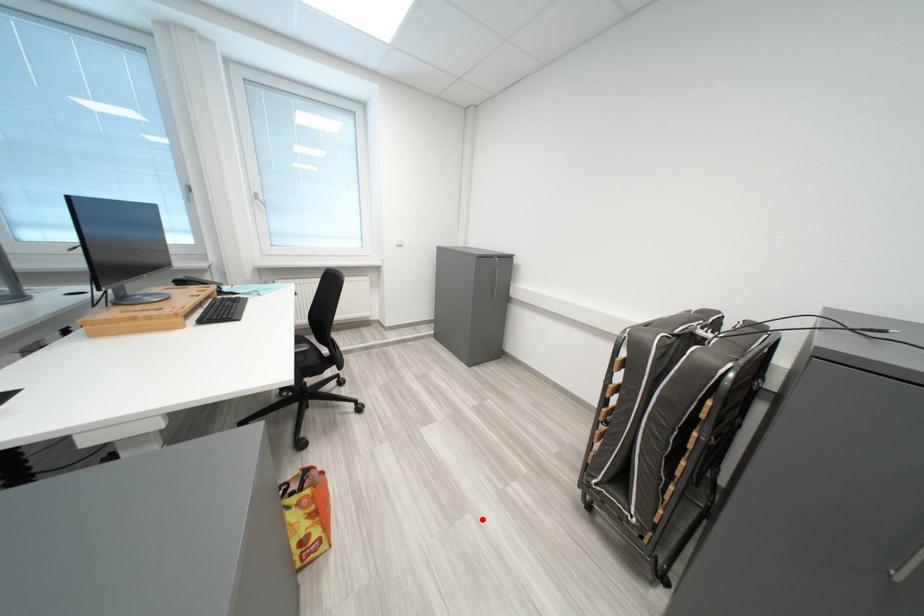
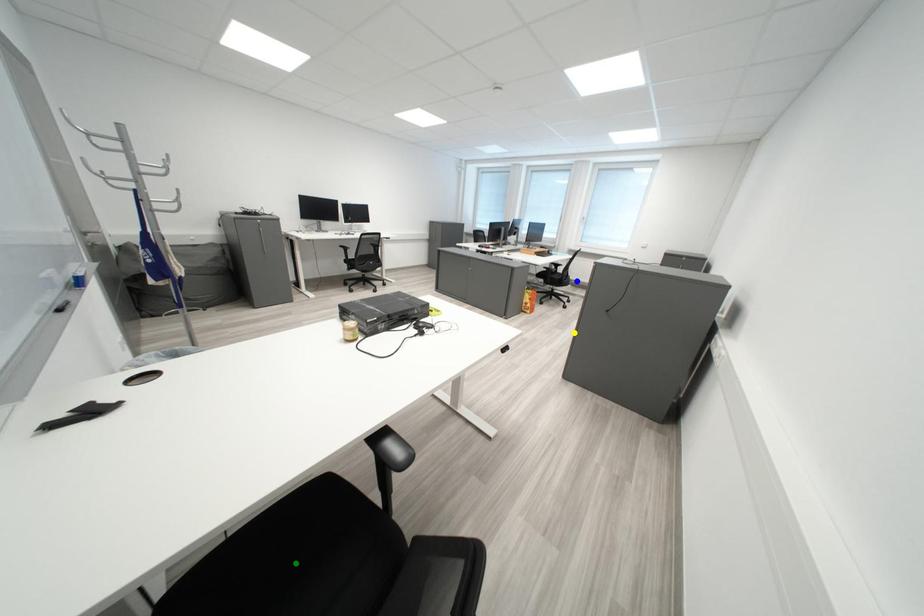
Question: I am providing you with two images of the same scene from different viewpoints. A red point is marked on the first image. You are given multiple points on the second image. Which mark in image 2 goes with the point in image 1?

Choices:
 (A) blue point
 (B) green point
 (C) yellow point

Answer: (C)